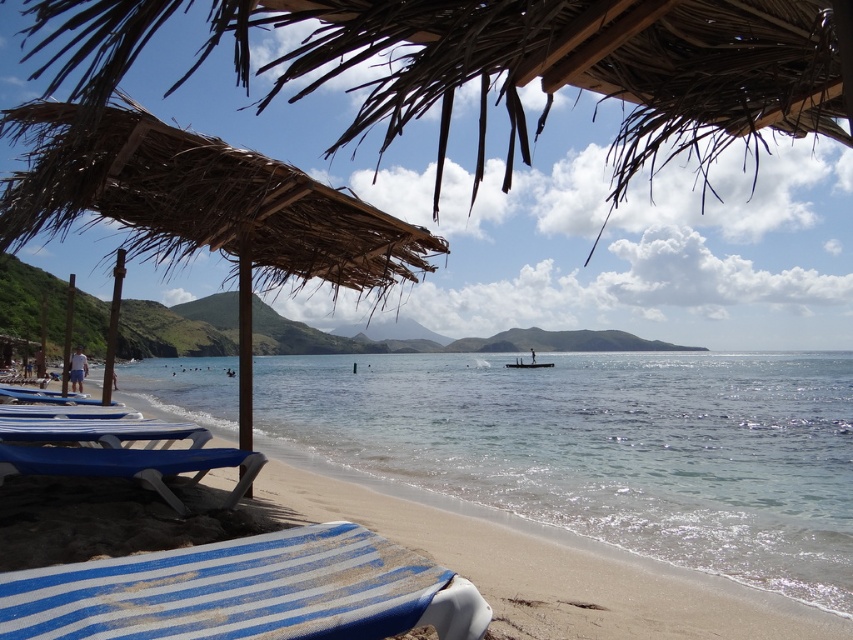
You are a photographer trying to capture a shot of the thatched straw umbrella at upper left and the blue plastic beach chair at lower left. Which object is positioned closer to your camera lens?

The thatched straw umbrella at upper left is closer to the viewer than the blue plastic beach chair at lower left, so it will appear closer to the camera lens.

You are a photographer standing at the beach scene. You want to take a photo that includes both the point at coordinates point (136, 195) and point (67, 472). Which point should you position closer to the camera to ensure both are in focus?

Point (136, 195) is closer to the viewer than point (67, 472). To ensure both are in focus, position the camera so that the closer point (136, 195) is near the focal plane, as depth of field will naturally include the farther point (67, 472) within acceptable sharpness.

Consider the image. You are a beachgoer who wants to know if the clear blue water at center is larger in size compared to the blue striped fabric beach chair at lower left. Can you confirm this?

The clear blue water at center is bigger than the blue striped fabric beach chair at lower left, so yes, the clear blue water at center is larger in size compared to the blue striped fabric beach chair at lower left.